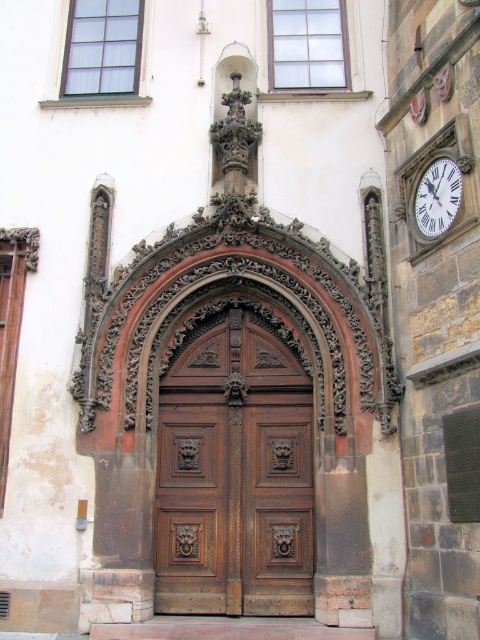
You are standing in front of the grand wooden door and want to place a decorative stone at the point marked as point (170,388). The stone requires a minimum of 50 meters of space to be placed safely. Can you place the stone there?

The point (170,388) is only 47.65 meters away from the door, which is less than the required 50 meters for safe placement. Therefore, you cannot place the stone there.

You are standing in front of the grand entrance and need to locate the time. Where is the white glossy clock at upper right in relation to the polished wood door at center?

The white glossy clock at upper right is positioned above the polished wood door at center.

You are standing in front of the grand entrance and need to locate the clock. Based on the scene, where is the white glossy clock at upper right positioned relative to the polished wood door at center?

The white glossy clock at upper right is to the right of the polished wood door at center.